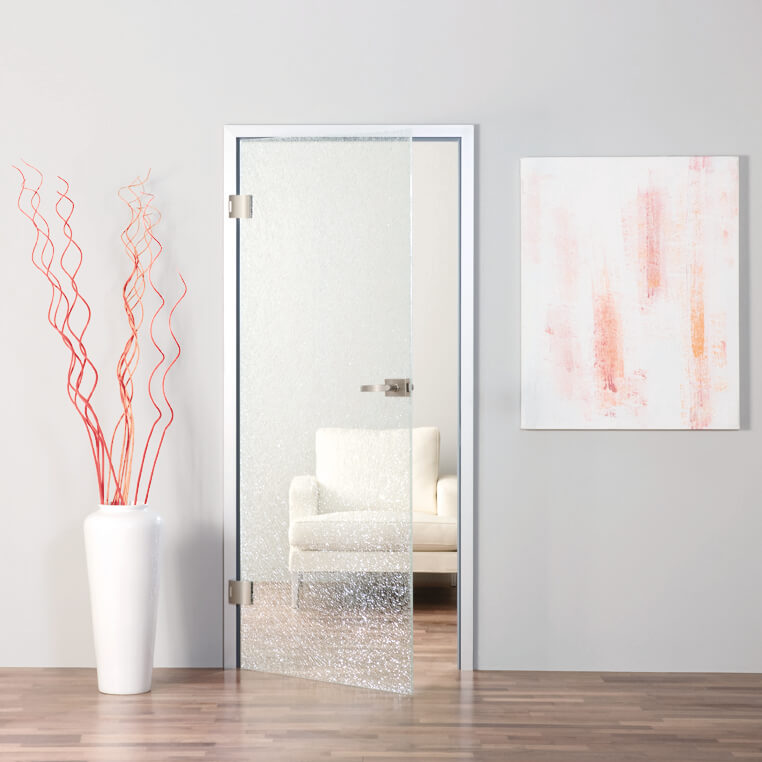
Image resolution: width=762 pixels, height=762 pixels. In order to click on handle in this screenshot , I will do `click(395, 399)`.